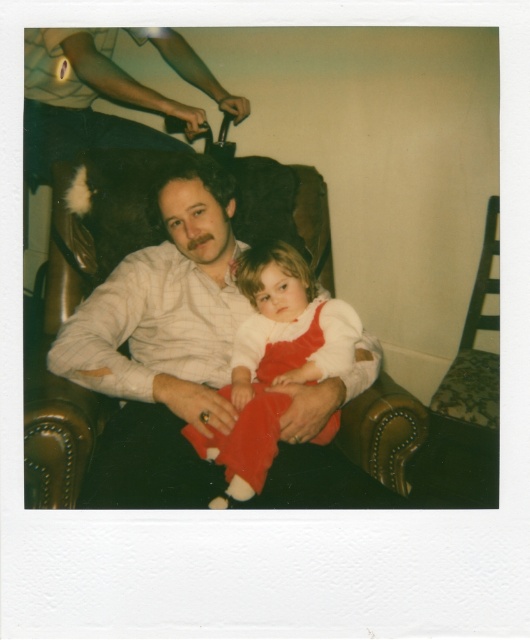
You are standing in front of a Polaroid photo showing two people sitting on a dark brown leather armchair. There are two points marked on the image at coordinates point (173, 422) and point (245, 381). Based on the photo, which of these two points is closer to you, the viewer?

Point (173, 422) is in front of point (245, 381), so it is closer to the viewer.

From the picture: You are a photographer trying to frame a shot of the matte white shirt at center and the matte brown leather chair at upper left. Which object is narrower in the image?

The matte white shirt at center is narrower than the matte brown leather chair at upper left.

Based on the scene described, where is the matte white shirt at center located in terms of its 2D coordinates?

The matte white shirt at center is located at the 2D coordinates of point (163,330).